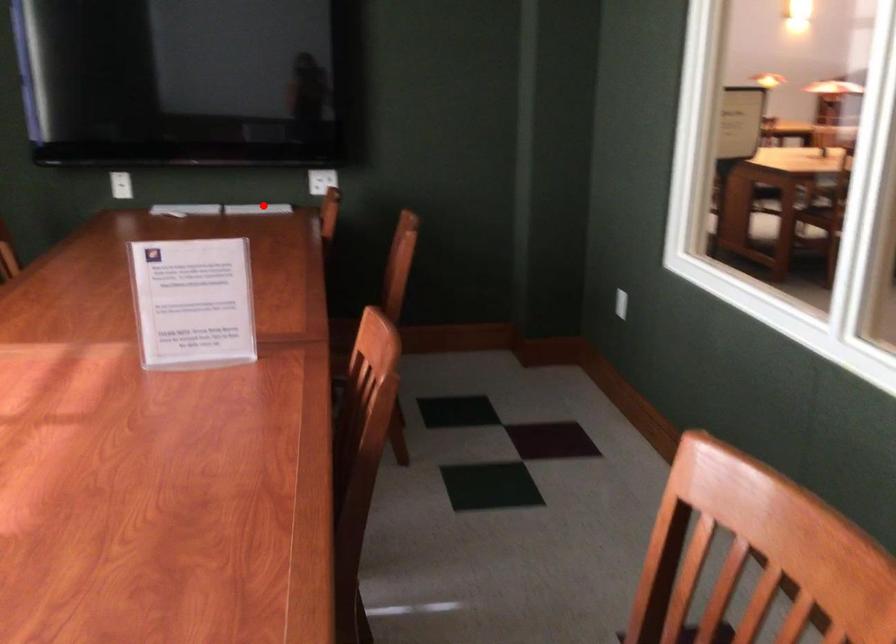
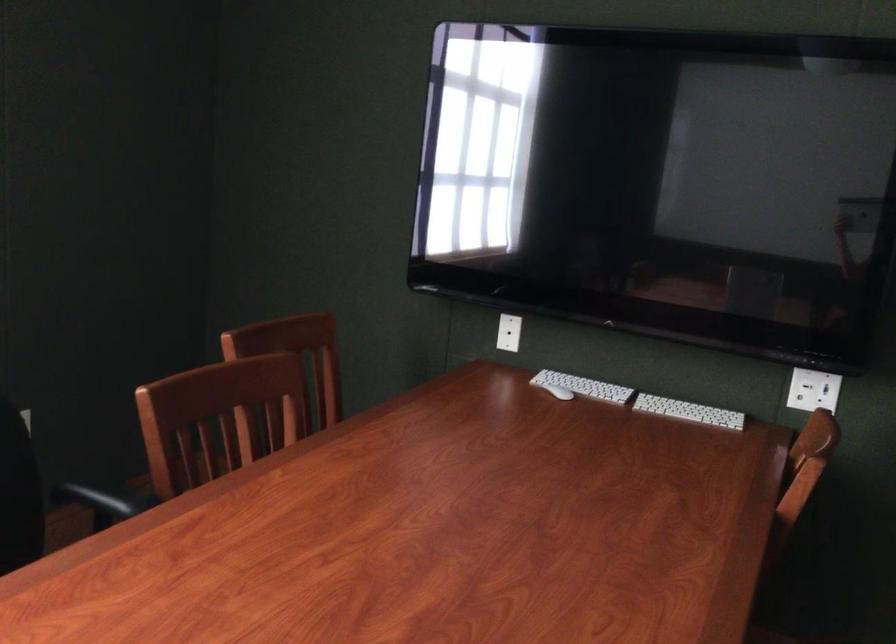
Question: I am providing you with two images of the same scene from different viewpoints. A red point is marked on the first image. Is the red point's position out of view in image 2?

Choices:
 (A) Yes
 (B) No

Answer: (B)